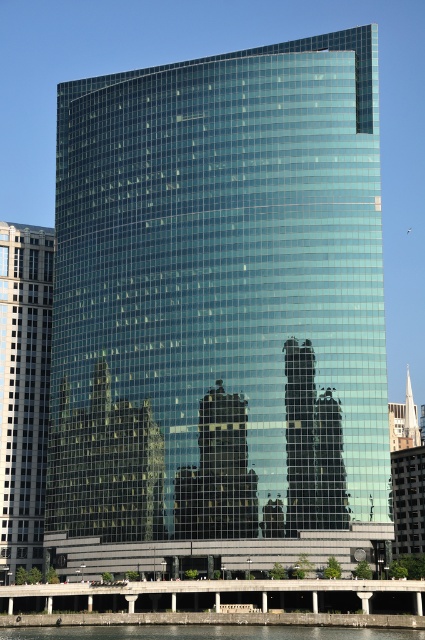
Question: Which object is positioned closest to the transparent glass skyscraper at center?

Choices:
 (A) transparent glass building at center
 (B) clear glass water at lower center

Answer: (A)

Question: Does transparent glass building at center come behind clear glass water at lower center?

Choices:
 (A) yes
 (B) no

Answer: (A)

Question: Considering the relative positions of transparent glass building at center and transparent glass skyscraper at center in the image provided, where is transparent glass building at center located with respect to transparent glass skyscraper at center?

Choices:
 (A) below
 (B) above

Answer: (B)

Question: Which object is closer to the camera taking this photo?

Choices:
 (A) clear glass water at lower center
 (B) transparent glass skyscraper at center

Answer: (A)

Question: Does transparent glass building at center come behind transparent glass skyscraper at center?

Choices:
 (A) yes
 (B) no

Answer: (B)

Question: Estimate the real-world distances between objects in this image. Which object is closer to the transparent glass skyscraper at center?

Choices:
 (A) clear glass water at lower center
 (B) transparent glass building at center

Answer: (B)